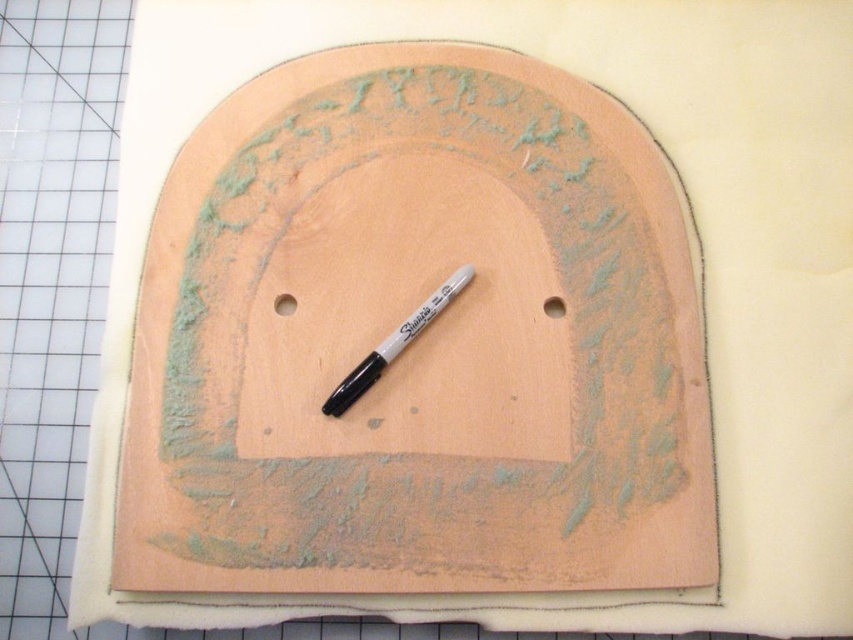
Question: Is black marker at center to the left of smooth orange wood hole at center from the viewer's perspective?

Choices:
 (A) yes
 (B) no

Answer: (A)

Question: Estimate the real-world distances between objects in this image. Which object is farther from the smooth orange wood hole at center?

Choices:
 (A) peach wood board at center
 (B) black marker at center
 (C) matte wood hole at center

Answer: (C)

Question: Can you confirm if peach wood board at center is positioned below matte wood hole at center?

Choices:
 (A) no
 (B) yes

Answer: (B)

Question: Is the position of black marker at center more distant than that of matte wood hole at center?

Choices:
 (A) yes
 (B) no

Answer: (B)

Question: Which point appears farthest from the camera in this image?

Choices:
 (A) (547, 310)
 (B) (293, 300)
 (C) (683, 577)

Answer: (A)

Question: Which object appears farthest from the camera in this image?

Choices:
 (A) black marker at center
 (B) matte wood hole at center

Answer: (B)